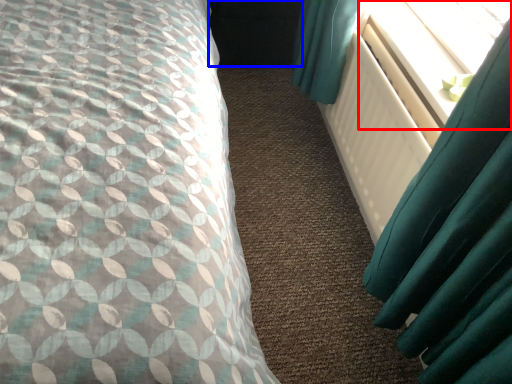
Question: Which point is further to the camera, window screen (highlighted by a red box) or dark (highlighted by a blue box)?

Choices:
 (A) window screen
 (B) dark

Answer: (B)